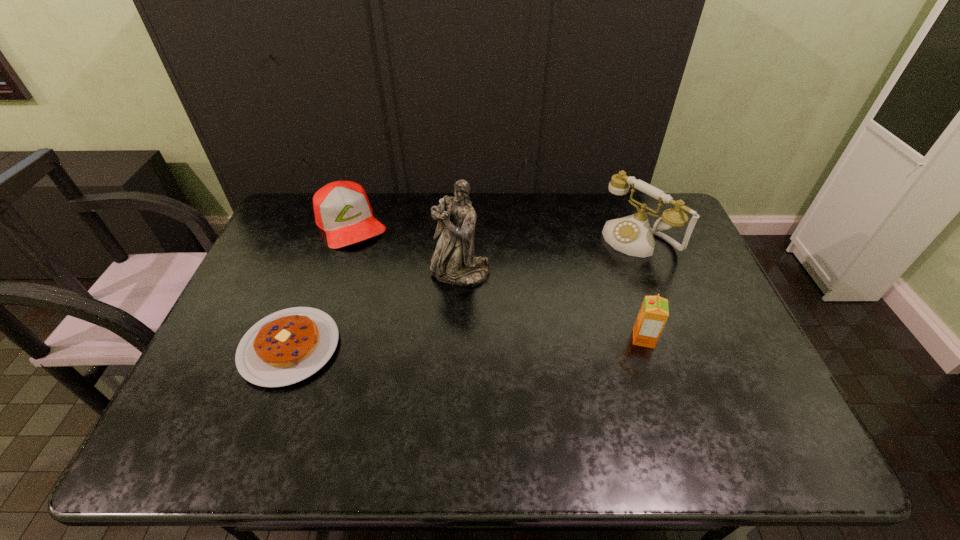
The width and height of the screenshot is (960, 540). In order to click on free point located 0.210m on the front-facing side of the fourth tallest object in this screenshot , I will do `click(389, 286)`.

I want to click on vacant position located on the dial of the telephone, so click(590, 273).

Where is `free space located on the dial of the telephone`? This screenshot has width=960, height=540. free space located on the dial of the telephone is located at coordinates (561, 293).

Where is `vacant space located 0.080m on the dial of the telephone`? vacant space located 0.080m on the dial of the telephone is located at coordinates click(601, 266).

I want to click on free spot located 0.210m on the front-facing side of the tallest object, so click(x=418, y=340).

I want to click on free region located 0.180m on the front-facing side of the tallest object, so click(422, 332).

You are a GUI agent. You are given a task and a screenshot of the screen. Output one action in this format:
    pyautogui.click(x=<x>, y=<y>)
    Task: Click on the free space located on the front-facing side of the tallest object
    This screenshot has width=960, height=540.
    Given the screenshot: What is the action you would take?
    pyautogui.click(x=433, y=313)

You are a GUI agent. You are given a task and a screenshot of the screen. Output one action in this format:
    pyautogui.click(x=<x>, y=<y>)
    Task: Click on the baseball cap at the far edge
    The width and height of the screenshot is (960, 540).
    Given the screenshot: What is the action you would take?
    pyautogui.click(x=342, y=209)

Identify the location of telephone situated at the far edge. The width and height of the screenshot is (960, 540). (632, 235).

Locate an element on the screen. The width and height of the screenshot is (960, 540). object that is at the near edge is located at coordinates (285, 347).